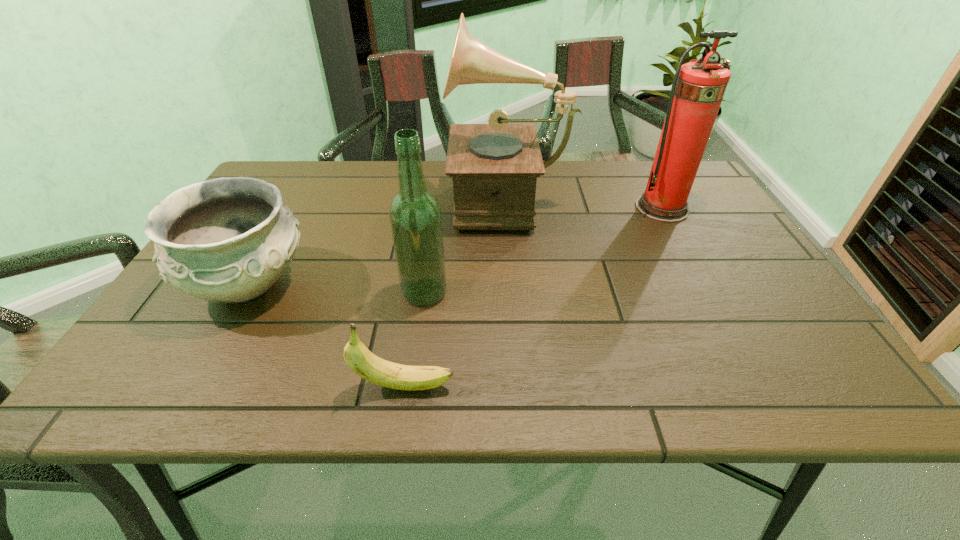
Image resolution: width=960 pixels, height=540 pixels. Find the location of `vacant area at the far edge of the desktop`. vacant area at the far edge of the desktop is located at coordinates (630, 193).

Locate an element on the screen. Image resolution: width=960 pixels, height=540 pixels. vacant space at the near edge is located at coordinates (551, 367).

Where is `vacant point at the right edge`? The image size is (960, 540). vacant point at the right edge is located at coordinates (719, 214).

What are the coordinates of `free space between the record player and the leftmost object` in the screenshot? It's located at (378, 241).

At what (x,y) coordinates should I click in order to perform the action: click on vacant area between the shortest object and the record player. Please return your answer as a coordinate pair (x, y). The image size is (960, 540). Looking at the image, I should click on (456, 291).

Where is `free spot between the liquor and the fire extinguisher`? free spot between the liquor and the fire extinguisher is located at coordinates (543, 251).

At what (x,y) coordinates should I click in order to perform the action: click on unoccupied area between the record player and the second shortest object. Please return your answer as a coordinate pair (x, y). The width and height of the screenshot is (960, 540). Looking at the image, I should click on (378, 241).

The width and height of the screenshot is (960, 540). I want to click on free space between the leftmost object and the liquor, so click(337, 289).

Image resolution: width=960 pixels, height=540 pixels. In order to click on vacant space in between the rightmost object and the shortest object in this screenshot , I will do `click(533, 297)`.

Locate an element on the screen. The height and width of the screenshot is (540, 960). free spot between the banana and the third tallest object is located at coordinates (415, 339).